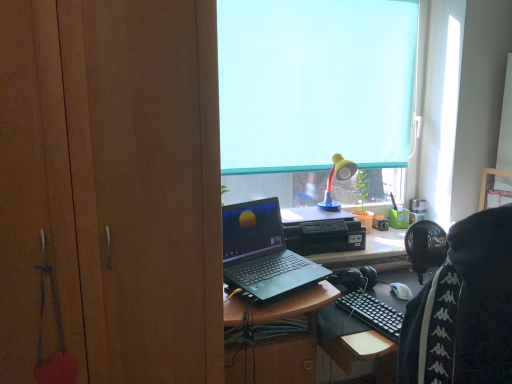
Question: Is there a large distance between wooden cabinet at left and yellow matte lamp at upper center?

Choices:
 (A) no
 (B) yes

Answer: (B)

Question: Is wooden cabinet at left with yellow matte lamp at upper center?

Choices:
 (A) no
 (B) yes

Answer: (A)

Question: Does wooden cabinet at left turn towards yellow matte lamp at upper center?

Choices:
 (A) yes
 (B) no

Answer: (B)

Question: From the image's perspective, would you say wooden cabinet at left is positioned over yellow matte lamp at upper center?

Choices:
 (A) yes
 (B) no

Answer: (B)

Question: From a real-world perspective, is wooden cabinet at left below yellow matte lamp at upper center?

Choices:
 (A) no
 (B) yes

Answer: (B)

Question: Is blue fabric at upper center to the left or to the right of yellow matte lamp at upper center in the image?

Choices:
 (A) left
 (B) right

Answer: (A)

Question: In terms of height, does blue fabric at upper center look taller or shorter compared to yellow matte lamp at upper center?

Choices:
 (A) tall
 (B) short

Answer: (A)

Question: Would you say blue fabric at upper center is inside or outside yellow matte lamp at upper center?

Choices:
 (A) outside
 (B) inside

Answer: (A)

Question: Considering the positions of blue fabric at upper center and yellow matte lamp at upper center in the image, is blue fabric at upper center wider or thinner than yellow matte lamp at upper center?

Choices:
 (A) thin
 (B) wide

Answer: (A)

Question: From the image's perspective, is blue fabric at upper center positioned above or below wooden cabinet at left?

Choices:
 (A) above
 (B) below

Answer: (A)

Question: Is point (315, 52) positioned closer to the camera than point (178, 64)?

Choices:
 (A) closer
 (B) farther

Answer: (B)

Question: In terms of size, does blue fabric at upper center appear bigger or smaller than wooden cabinet at left?

Choices:
 (A) small
 (B) big

Answer: (A)

Question: Considering their positions, is blue fabric at upper center located in front of or behind wooden cabinet at left?

Choices:
 (A) behind
 (B) front

Answer: (A)

Question: Choose the correct answer: Is yellow matte lamp at upper center inside wooden cabinet at left or outside it?

Choices:
 (A) inside
 (B) outside

Answer: (B)

Question: Is yellow matte lamp at upper center taller or shorter than wooden cabinet at left?

Choices:
 (A) tall
 (B) short

Answer: (B)